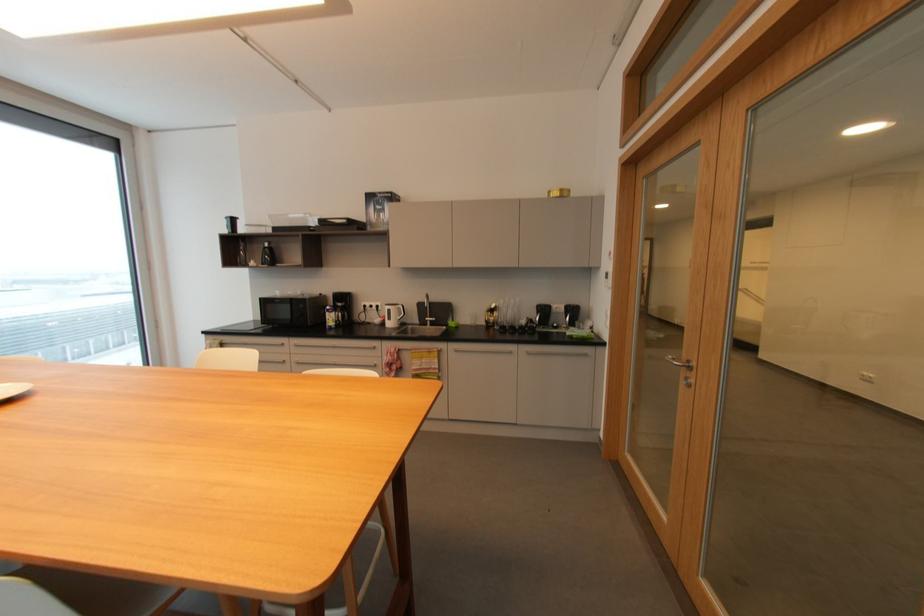
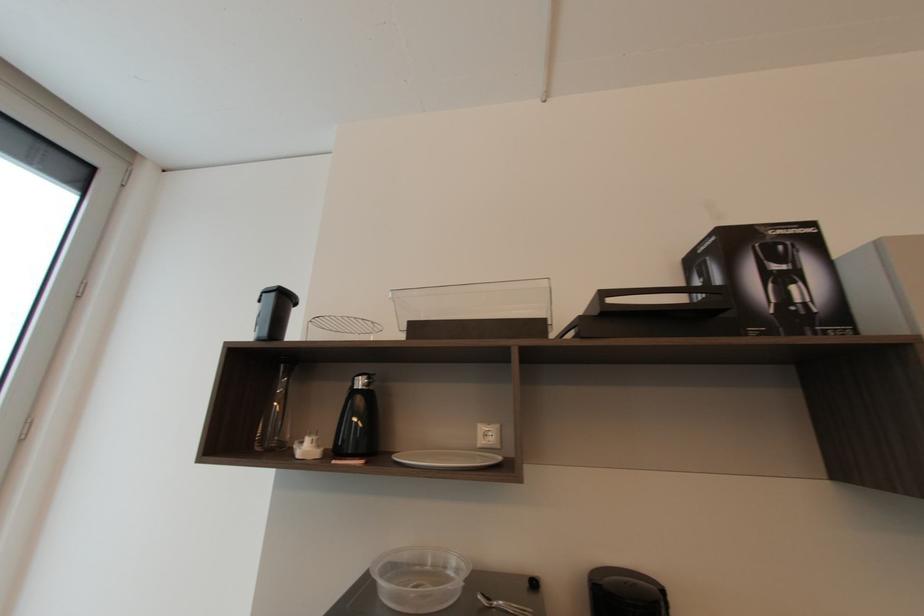
Locate, in the second image, the point that corresponds to (383,214) in the first image.

(796, 288)